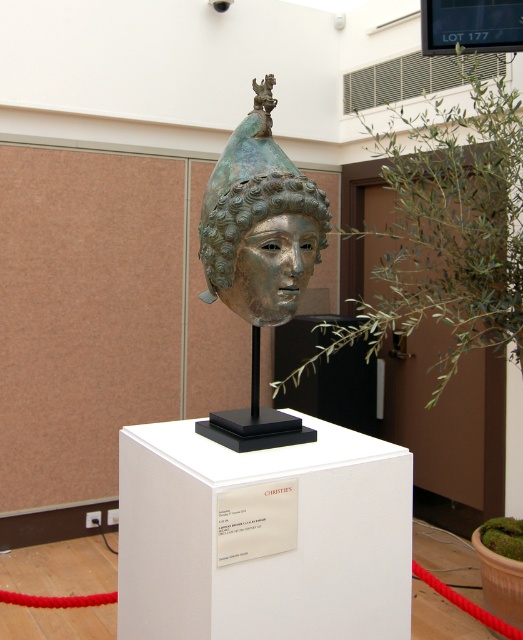
You are a museum visitor standing in front of the exhibit. You notice two points marked on the display case. The first point is at coordinates point (301, 250) and the second is at point (272, 269). Which point is closer to your eyes?

Point (301, 250) is further to the camera than point (272, 269), so the second point is closer to your eyes.

From the picture: You are a museum curator who needs to place a new decorative item between the shiny bronze mask at center and the shiny silver mask at center. The item is 2 inches wide. Will it fit without overlapping either mask?

The shiny bronze mask at center and shiny silver mask at center are 2.24 inches apart. Since the item is 2 inches wide, it will fit between them without overlapping as 2 inches is less than 2.24 inches.

You are a visitor at the museum standing in front of the exhibit. You notice two points marked on the floor. The first point is at location point (415, 289) and the second point is at point (260, 269). If you were to walk from the first point to the second point, would you be moving towards the museum entrance which is located behind you?

Point (415, 289) is behind point (260, 269). Therefore, moving from the first point to the second point would mean moving away from the entrance since you were initially facing away from it.